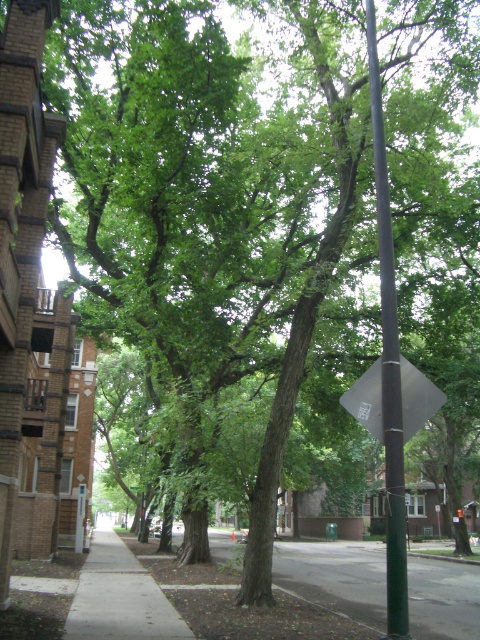
Can you confirm if gray concrete sidewalk at lower left is thinner than black plastic diamond at center-right?

No.

Which of these two, gray concrete sidewalk at lower left or black plastic diamond at center-right, stands shorter?

With less height is black plastic diamond at center-right.

Does point (96, 593) lie behind point (371, 376)?

Yes, it is.

This screenshot has height=640, width=480. Find the location of `gray concrete sidewalk at lower left`. gray concrete sidewalk at lower left is located at coordinates (120, 596).

Which of these two, green metallic pole at center or gray concrete sidewalk at lower left, stands shorter?

green metallic pole at center is shorter.

Is point (374, 132) positioned before point (108, 609)?

Yes, it is in front of point (108, 609).

Locate an element on the screen. green metallic pole at center is located at coordinates (388, 364).

Is point (402, 620) more distant than point (400, 374)?

No.

Which is in front, point (399, 413) or point (417, 397)?

Point (399, 413) is in front.

The height and width of the screenshot is (640, 480). Find the location of `green metallic pole at center`. green metallic pole at center is located at coordinates (388, 364).